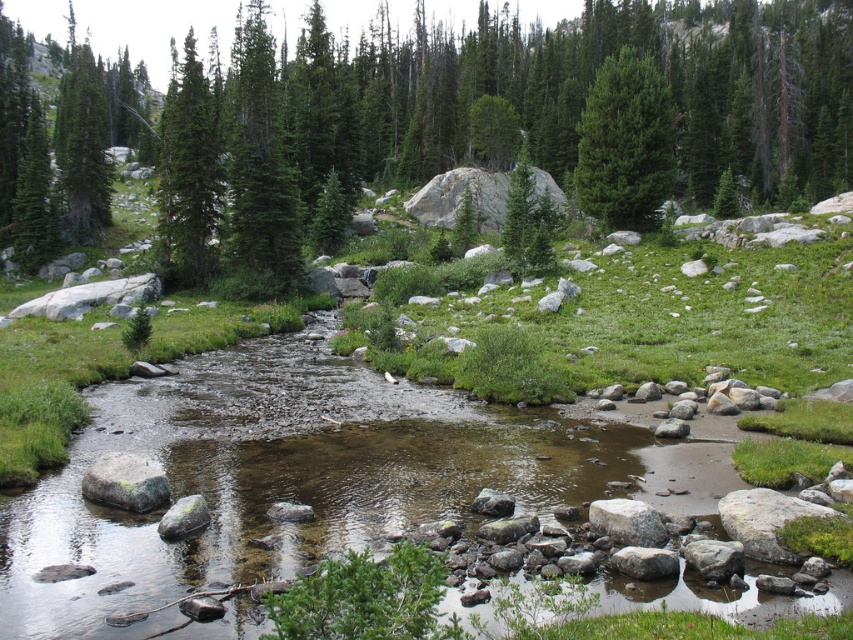
You are standing at the point with coordinates point (637, 118) and want to walk towards the forest in the background. Is the point point (807, 104) located behind you or in front of you as you face the forest?

The point point (807, 104) is behind point (637, 118), so if you are facing the forest in the background, the point point (807, 104) would be behind you.

You are standing in the meadow and want to walk from the green matte tree at upper left to the green matte tree at center. Which direction should you head?

You should head to the right because the green matte tree at center is to the right of the green matte tree at upper left.